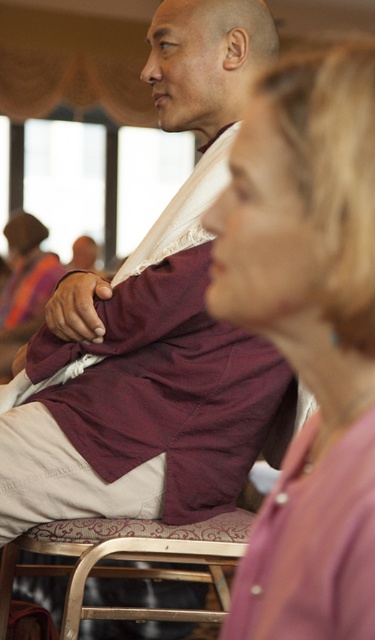
Question: Can you confirm if pink fabric shirt at center is thinner than pink fabric at lower right?

Choices:
 (A) no
 (B) yes

Answer: (A)

Question: Which point appears farthest from the camera in this image?

Choices:
 (A) (346, 348)
 (B) (364, 614)

Answer: (A)

Question: Is the position of pink fabric shirt at center more distant than that of pink fabric at lower right?

Choices:
 (A) yes
 (B) no

Answer: (B)

Question: Is pink fabric shirt at center to the left of pink fabric at lower right from the viewer's perspective?

Choices:
 (A) yes
 (B) no

Answer: (A)